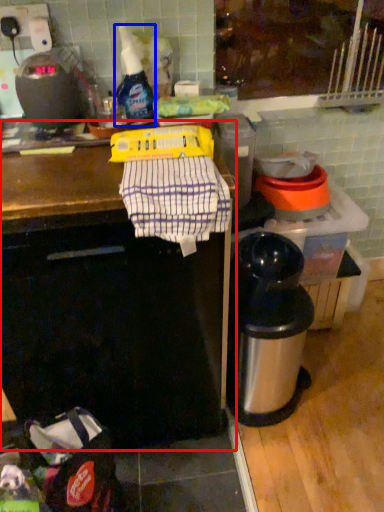
Question: Which object is closer to the camera taking this photo, counter (highlighted by a red box) or bottle (highlighted by a blue box)?

Choices:
 (A) counter
 (B) bottle

Answer: (A)